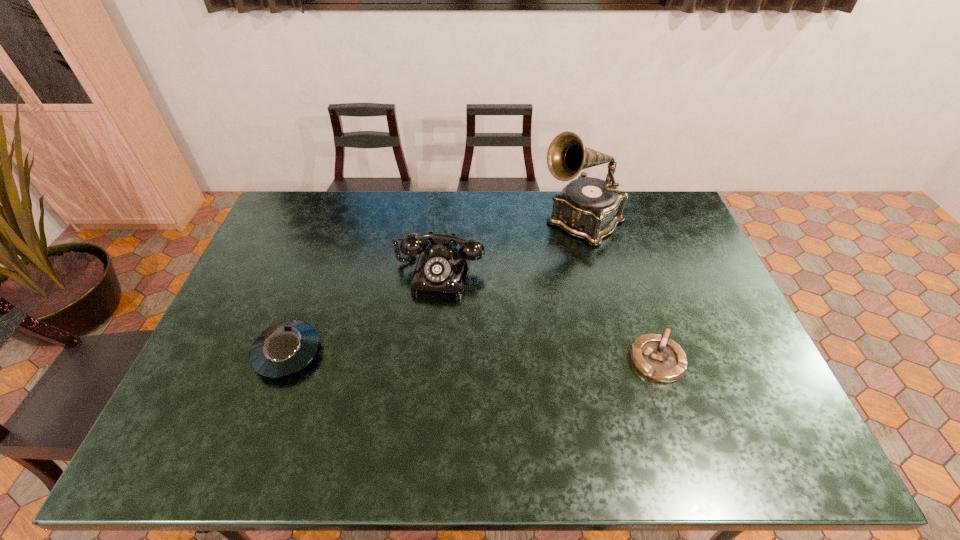
In order to click on the leftmost object in this screenshot , I will do `click(283, 349)`.

Where is `saucer`? This screenshot has height=540, width=960. saucer is located at coordinates (283, 349).

This screenshot has height=540, width=960. In order to click on ashtray in this screenshot , I will do (x=658, y=358).

You are a GUI agent. You are given a task and a screenshot of the screen. Output one action in this format:
    pyautogui.click(x=<x>, y=<y>)
    Task: Click on the second object from left to right
    Image resolution: width=960 pixels, height=540 pixels.
    Given the screenshot: What is the action you would take?
    pyautogui.click(x=441, y=272)

Image resolution: width=960 pixels, height=540 pixels. What are the coordinates of `the third shortest object` in the screenshot? It's located at (441, 272).

You are a GUI agent. You are given a task and a screenshot of the screen. Output one action in this format:
    pyautogui.click(x=<x>, y=<y>)
    Task: Click on the tallest object
    The width and height of the screenshot is (960, 540).
    Given the screenshot: What is the action you would take?
    pyautogui.click(x=589, y=208)

Locate an element on the screen. free space located on the left of the third tallest object is located at coordinates (236, 353).

In order to click on free region located on the back of the shortest object in this screenshot , I will do `click(635, 291)`.

Identify the location of free space located 0.200m on the dial of the second tallest object. This screenshot has width=960, height=540. (417, 357).

At what (x,y) coordinates should I click in order to perform the action: click on vacant region located on the dial of the second tallest object. Please return your answer as a coordinate pair (x, y). Looking at the image, I should click on (410, 388).